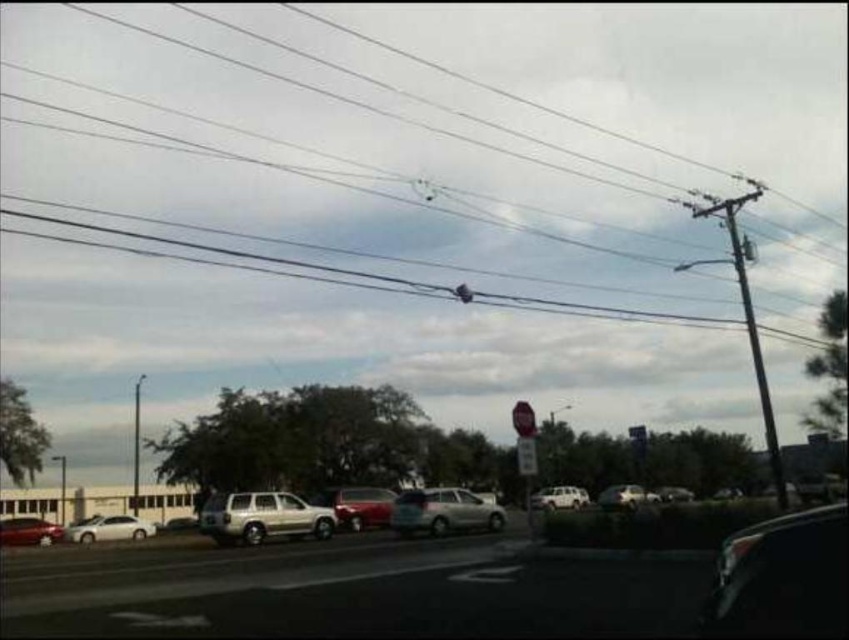
You are standing at the center of the street and want to walk towards the smooth gray pole at right. Based on its position, in which direction should you head?

The smooth gray pole at right is located at point 0.483 on the x and 0.876 on the y axis. Since you are at the center, you should head towards the right and slightly forward to reach it.

You are a pedestrian standing at the camera position. You see the shiny red car at center. Can you safely walk to it without needing to cross any streets or obstacles?

The shiny red car at center is 1402.90 feet away from camera. Since the distance is quite large, you would need to walk a significant distance, but there is no mention of streets or obstacles in the scene description. However, the scene mentions parked cars and utility poles with wires, so there might be obstacles. Without specific information about paths or obstructions, it is uncertain if you can safely walk directly to the shiny red car at center.

You are standing at the stop sign in the street scene. You see two points marked as point (x=746, y=276) and point (x=454, y=289). Which point is closer to you?

Point (x=746, y=276) is in front of point (x=454, y=289), so it is closer to you.